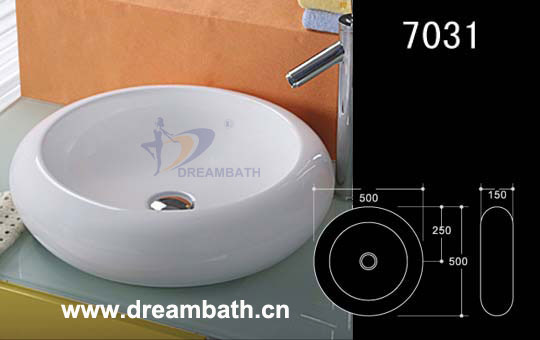
Where is `wall`? The height and width of the screenshot is (340, 540). wall is located at coordinates (168, 65).